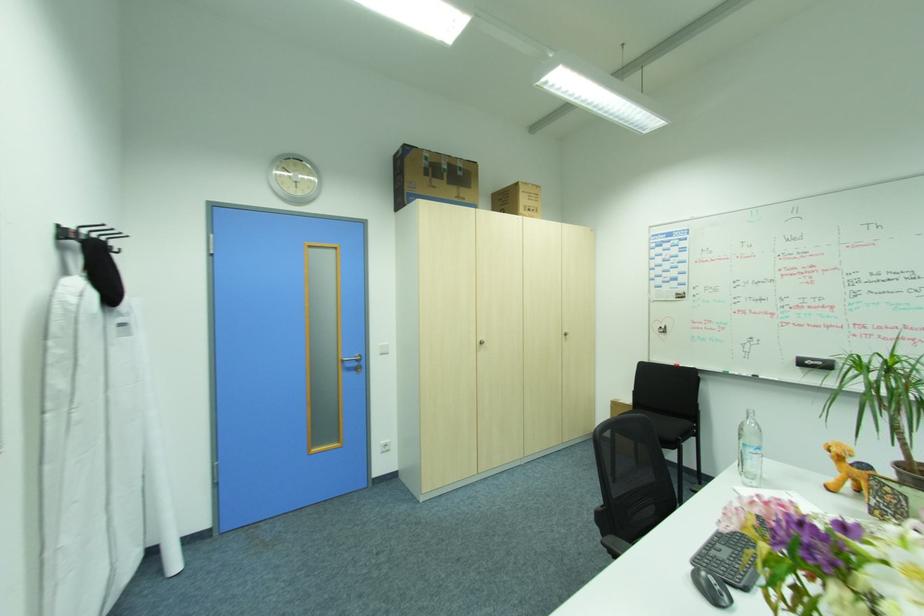
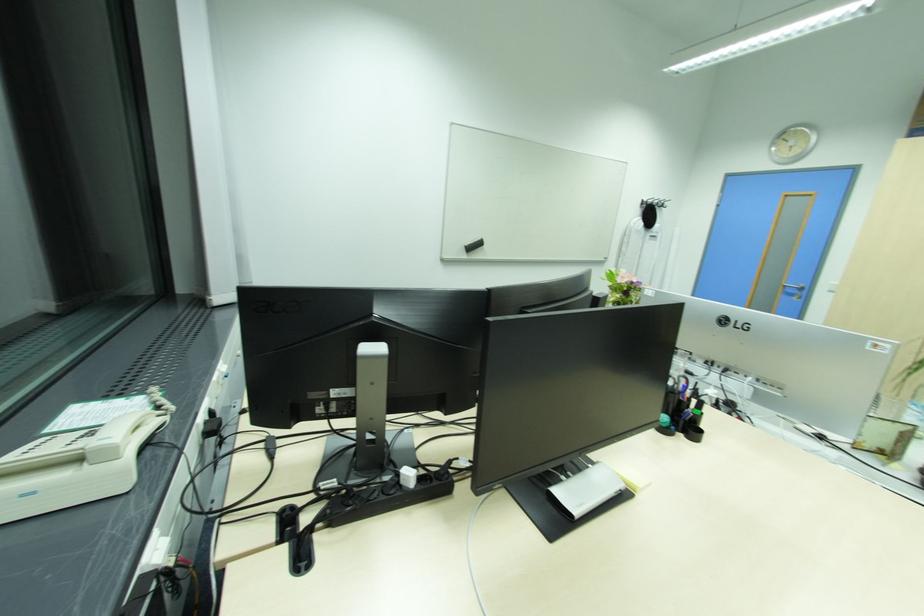
Locate, in the second image, the point that corresponds to point 360,363 in the first image.

(801, 291)